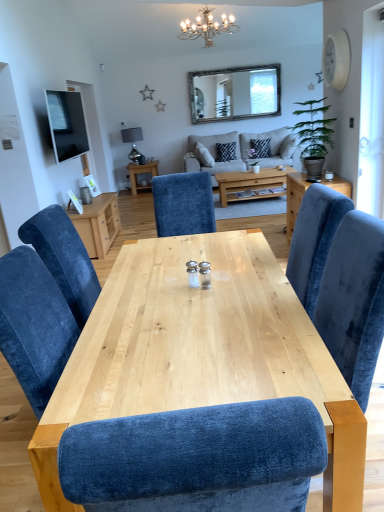
Question: From the image's perspective, is wooden-framed mirror at upper center beneath white metallic chandelier at upper center?

Choices:
 (A) no
 (B) yes

Answer: (B)

Question: Could you tell me if wooden-framed mirror at upper center is facing white metallic chandelier at upper center?

Choices:
 (A) yes
 (B) no

Answer: (B)

Question: Is wooden-framed mirror at upper center positioned with its back to white metallic chandelier at upper center?

Choices:
 (A) yes
 (B) no

Answer: (B)

Question: Can you confirm if wooden-framed mirror at upper center is bigger than white metallic chandelier at upper center?

Choices:
 (A) no
 (B) yes

Answer: (A)

Question: From a real-world perspective, is wooden-framed mirror at upper center physically above white metallic chandelier at upper center?

Choices:
 (A) no
 (B) yes

Answer: (A)

Question: From their relative heights in the image, would you say green leafy plant at right is taller or shorter than wooden-framed mirror at upper center?

Choices:
 (A) tall
 (B) short

Answer: (B)

Question: From the image's perspective, is green leafy plant at right above or below wooden-framed mirror at upper center?

Choices:
 (A) below
 (B) above

Answer: (A)

Question: Is green leafy plant at right in front of or behind wooden-framed mirror at upper center in the image?

Choices:
 (A) behind
 (B) front

Answer: (B)

Question: Considering the positions of green leafy plant at right and wooden-framed mirror at upper center in the image, is green leafy plant at right wider or thinner than wooden-framed mirror at upper center?

Choices:
 (A) wide
 (B) thin

Answer: (A)

Question: Is velvet blue chair at right, the 2th table in the top-to-bottom sequence, situated inside wooden-framed mirror at upper center or outside?

Choices:
 (A) outside
 (B) inside

Answer: (A)

Question: Does point (347, 182) appear closer or farther from the camera than point (233, 114)?

Choices:
 (A) farther
 (B) closer

Answer: (B)

Question: In terms of width, does velvet blue chair at right, the 1th table viewed from the right, look wider or thinner when compared to wooden-framed mirror at upper center?

Choices:
 (A) thin
 (B) wide

Answer: (B)

Question: From the image's perspective, is velvet blue chair at right, the 1th table viewed from the right, located above or below wooden-framed mirror at upper center?

Choices:
 (A) above
 (B) below

Answer: (B)

Question: Does point (256, 193) appear closer or farther from the camera than point (221, 155)?

Choices:
 (A) farther
 (B) closer

Answer: (B)

Question: From a real-world perspective, is natural wood coffee table at center positioned above or below black textured pillow at center?

Choices:
 (A) below
 (B) above

Answer: (A)